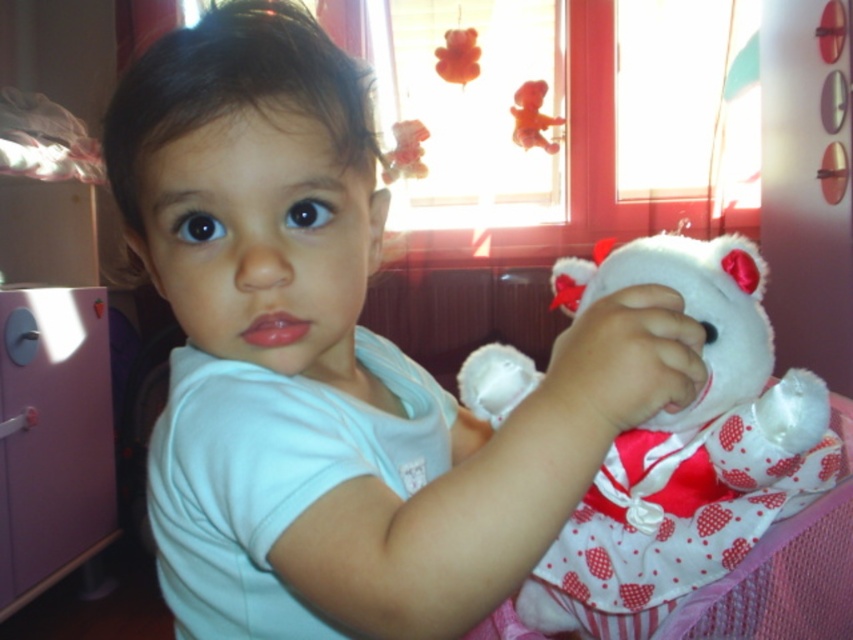
Question: Does white soft shirt at center appear under white soft teddy bear at center?

Choices:
 (A) no
 (B) yes

Answer: (A)

Question: Which is nearer to the fuzzy brown teddy bear at upper right?

Choices:
 (A) white soft shirt at center
 (B) white soft teddy bear at center

Answer: (B)

Question: In this image, where is white soft shirt at center located relative to white soft teddy bear at center?

Choices:
 (A) below
 (B) above

Answer: (B)

Question: Is white soft shirt at center below white soft teddy bear at center?

Choices:
 (A) no
 (B) yes

Answer: (A)

Question: Which is nearer to the white soft teddy bear at center?

Choices:
 (A) white soft shirt at center
 (B) fuzzy brown teddy bear at upper right

Answer: (A)

Question: Among these points, which one is nearest to the camera?

Choices:
 (A) (548, 144)
 (B) (311, 38)
 (C) (634, 596)

Answer: (B)